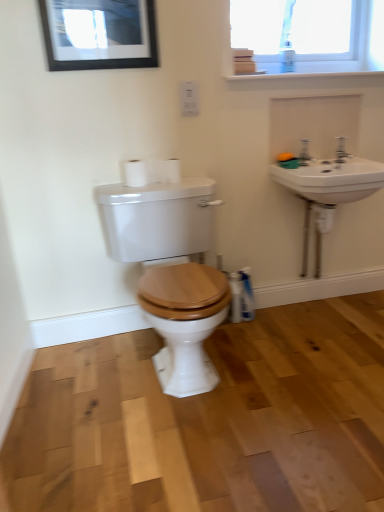
Identify the location of vacant area that lies to the right of wooden toilet seat at center. (301, 361).